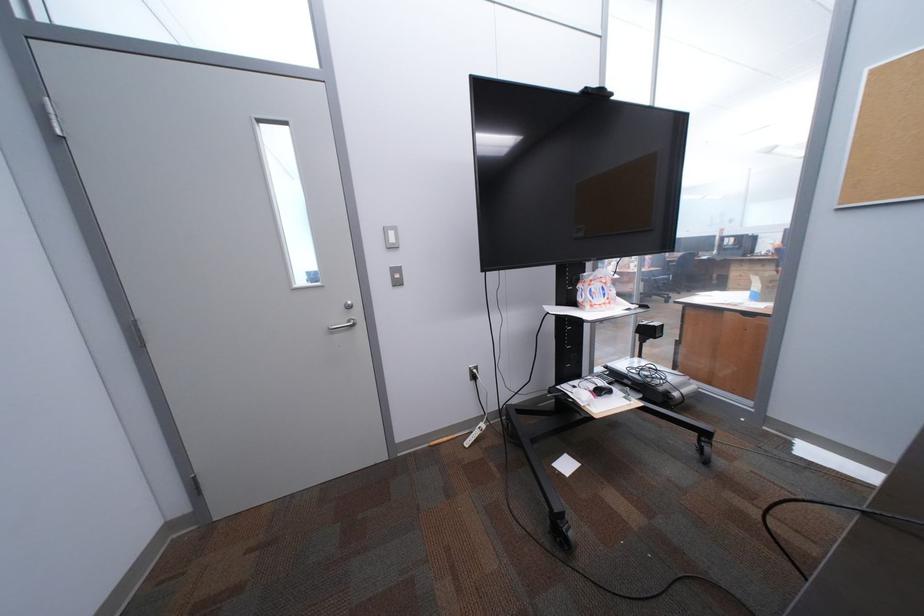
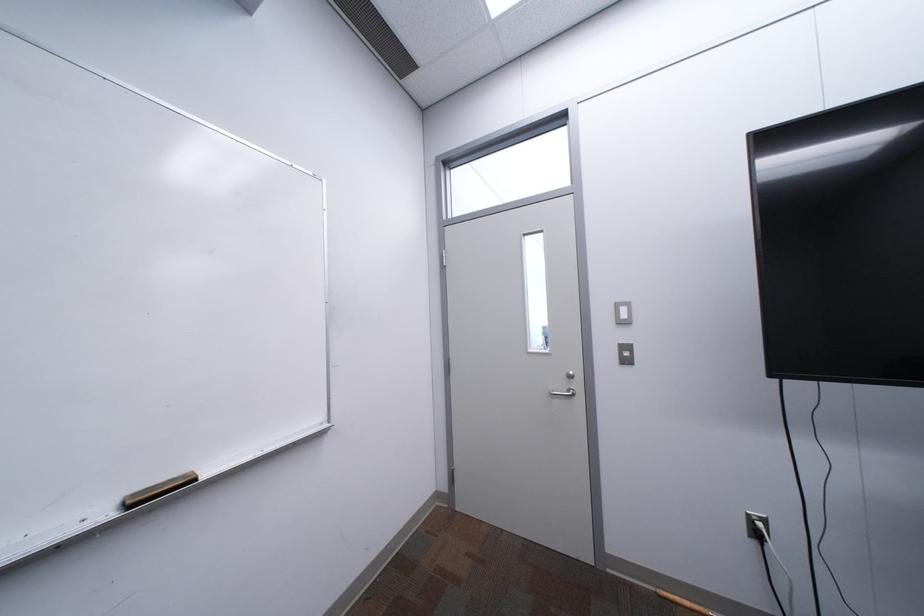
Question: The camera is either moving clockwise (left) or counter-clockwise (right) around the object. The first image is from the beginning of the video and the second image is from the end. Is the camera moving left or right when shooting the video?

Choices:
 (A) Left
 (B) Right

Answer: (B)